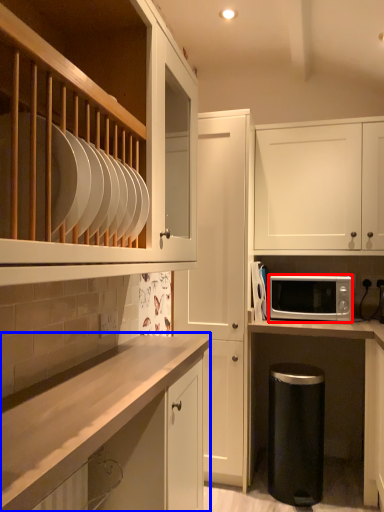
Question: Which of the following is the farthest to the observer, microwave oven (highlighted by a red box) or cabinetry (highlighted by a blue box)?

Choices:
 (A) microwave oven
 (B) cabinetry

Answer: (A)